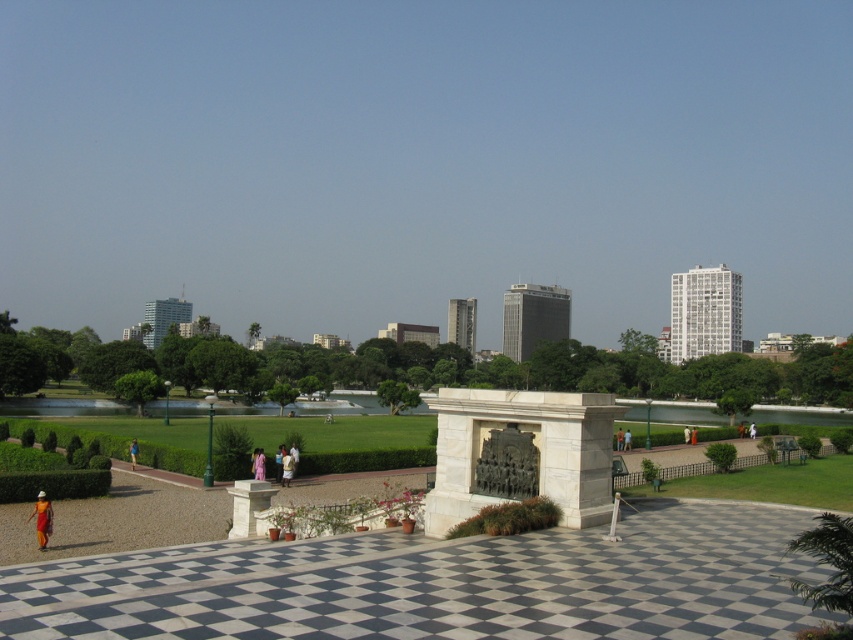
Question: Is orange fabric dress at lower left wider than light purple fabric at center?

Choices:
 (A) no
 (B) yes

Answer: (B)

Question: Which object appears farthest from the camera in this image?

Choices:
 (A) white stone monument at center
 (B) bronze relief at center
 (C) light purple fabric at center

Answer: (C)

Question: Can you confirm if bronze relief at center is positioned to the left of light purple fabric at center?

Choices:
 (A) yes
 (B) no

Answer: (B)

Question: Does white stone column at center have a lesser width compared to white cotton dress at center?

Choices:
 (A) yes
 (B) no

Answer: (A)

Question: Which object is positioned farthest from the light purple fabric at center?

Choices:
 (A) white stone monument at center
 (B) white cotton dress at center
 (C) white stone column at center

Answer: (A)

Question: Which point appears farthest from the camera in this image?

Choices:
 (A) (47, 540)
 (B) (248, 513)
 (C) (506, 465)
 (D) (135, 445)

Answer: (D)